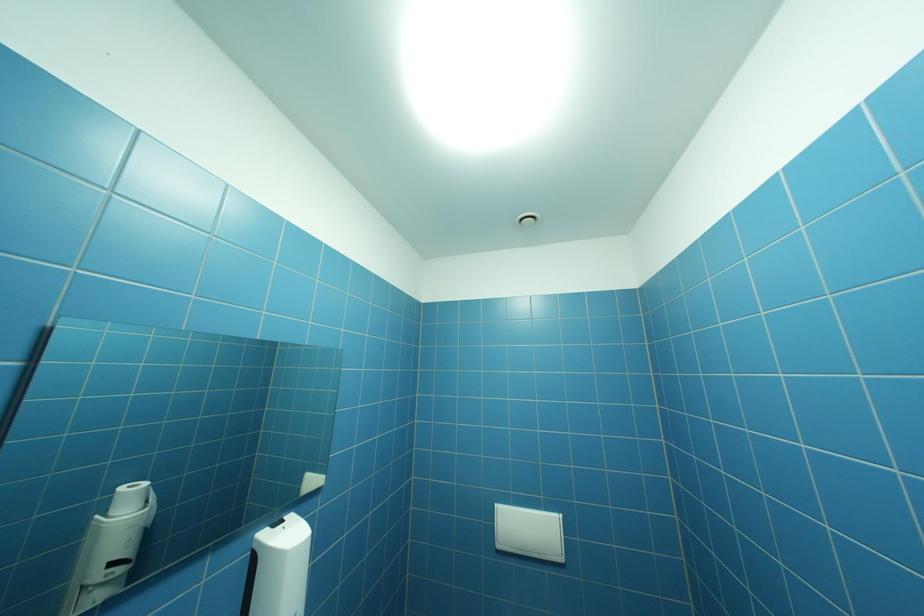
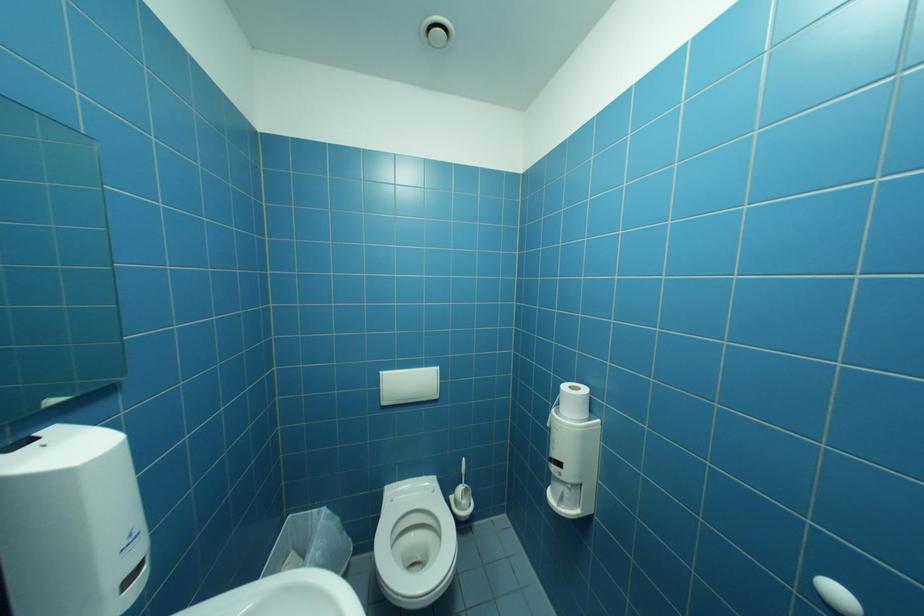
First-person continuous shooting, in which direction is the camera rotating?

The camera rotated toward right-down.